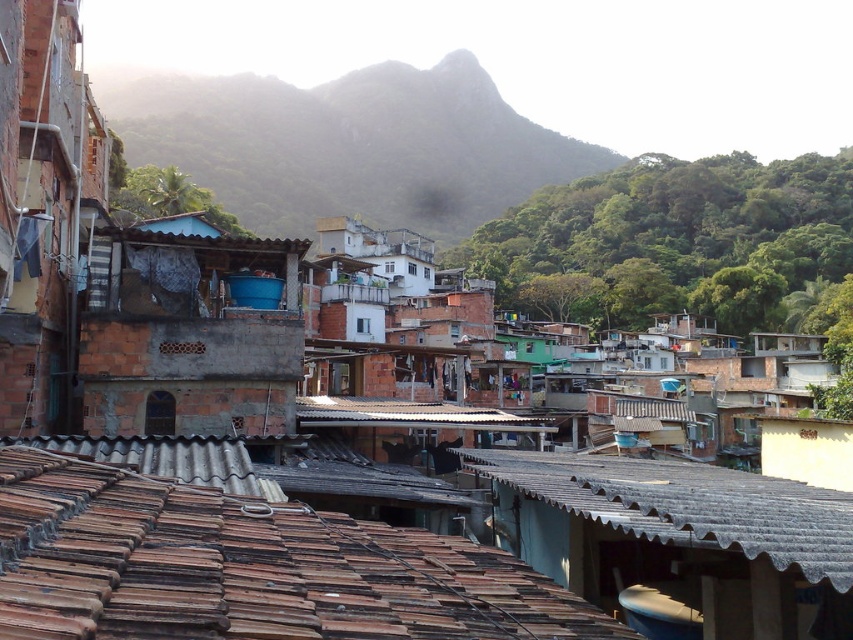
Between green leafy hillside at upper center and rusty brick hut at center-left, which one appears on the right side from the viewer's perspective?

rusty brick hut at center-left is more to the right.

Between point (315, 106) and point (100, 276), which one is positioned in front?

Positioned in front is point (100, 276).

Between point (210, 168) and point (146, 406), which one is positioned behind?

The point (210, 168) is more distant.

Where is `green leafy hillside at upper center`? green leafy hillside at upper center is located at coordinates (350, 145).

Is green leafy hillside at upper center shorter than rusty corrugated metal roof at center?

In fact, green leafy hillside at upper center may be taller than rusty corrugated metal roof at center.

Between green leafy hillside at upper center and rusty corrugated metal roof at center, which one has less height?

With less height is rusty corrugated metal roof at center.

Does point (555, 177) come closer to viewer compared to point (619, 484)?

No, it is behind (619, 484).

Identify the location of green leafy hillside at upper center. (350, 145).

Who is positioned more to the left, rusty brick hut at center-left or rusty corrugated metal roof at center?

From the viewer's perspective, rusty brick hut at center-left appears more on the left side.

Measure the distance between rusty brick hut at center-left and rusty corrugated metal roof at center.

rusty brick hut at center-left and rusty corrugated metal roof at center are 6.99 meters apart.

You are a GUI agent. You are given a task and a screenshot of the screen. Output one action in this format:
    pyautogui.click(x=<x>, y=<y>)
    Task: Click on the rusty brick hut at center-left
    Image resolution: width=853 pixels, height=640 pixels.
    Given the screenshot: What is the action you would take?
    pyautogui.click(x=190, y=333)